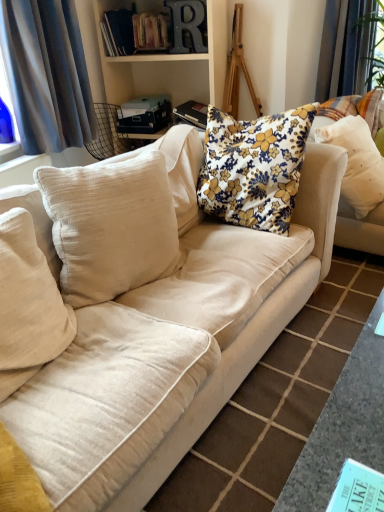
Question: Considering the relative positions of beige cotton pillow at left, which appears as the second pillow when viewed from the left, and beige fabric couch at center in the image provided, is beige cotton pillow at left, which appears as the second pillow when viewed from the left, to the right of beige fabric couch at center from the viewer's perspective?

Choices:
 (A) yes
 (B) no

Answer: (B)

Question: From the image's perspective, does beige cotton pillow at left, which is counted as the third pillow, starting from the right, appear higher than beige fabric couch at center?

Choices:
 (A) yes
 (B) no

Answer: (A)

Question: Would you consider beige cotton pillow at left, which is counted as the third pillow, starting from the right, to be distant from beige fabric couch at center?

Choices:
 (A) no
 (B) yes

Answer: (A)

Question: Is beige cotton pillow at left, which appears as the second pillow when viewed from the left, looking in the opposite direction of beige fabric couch at center?

Choices:
 (A) no
 (B) yes

Answer: (B)

Question: Does beige cotton pillow at left, which appears as the second pillow when viewed from the left, come in front of beige fabric couch at center?

Choices:
 (A) yes
 (B) no

Answer: (B)

Question: Does beige cotton pillow at left, which is counted as the third pillow, starting from the right, have a greater width compared to beige fabric couch at center?

Choices:
 (A) no
 (B) yes

Answer: (A)

Question: Can you confirm if beige cotton pillow at left, arranged as the 1th pillow when viewed from the left, is bigger than beige cotton pillow at left, which appears as the second pillow when viewed from the left?

Choices:
 (A) yes
 (B) no

Answer: (B)

Question: From a real-world perspective, is beige cotton pillow at left, which is the fourth pillow in right-to-left order, physically above beige cotton pillow at left, which appears as the second pillow when viewed from the left?

Choices:
 (A) no
 (B) yes

Answer: (A)

Question: Does beige cotton pillow at left, arranged as the 1th pillow when viewed from the left, contain beige cotton pillow at left, which is counted as the third pillow, starting from the right?

Choices:
 (A) no
 (B) yes

Answer: (A)

Question: Is beige cotton pillow at left, arranged as the 1th pillow when viewed from the left, beside beige cotton pillow at left, which appears as the second pillow when viewed from the left?

Choices:
 (A) yes
 (B) no

Answer: (B)

Question: From the image's perspective, is beige cotton pillow at left, which is the fourth pillow in right-to-left order, located above beige cotton pillow at left, which appears as the second pillow when viewed from the left?

Choices:
 (A) yes
 (B) no

Answer: (B)

Question: Does beige cotton pillow at left, which is the fourth pillow in right-to-left order, have a lesser width compared to beige cotton pillow at left, which is counted as the third pillow, starting from the right?

Choices:
 (A) yes
 (B) no

Answer: (B)

Question: Is hardcover books at upper center, which is the third book from right to left, bigger than black hardcover book at upper center, which ranks as the third book in bottom-to-top order?

Choices:
 (A) no
 (B) yes

Answer: (B)